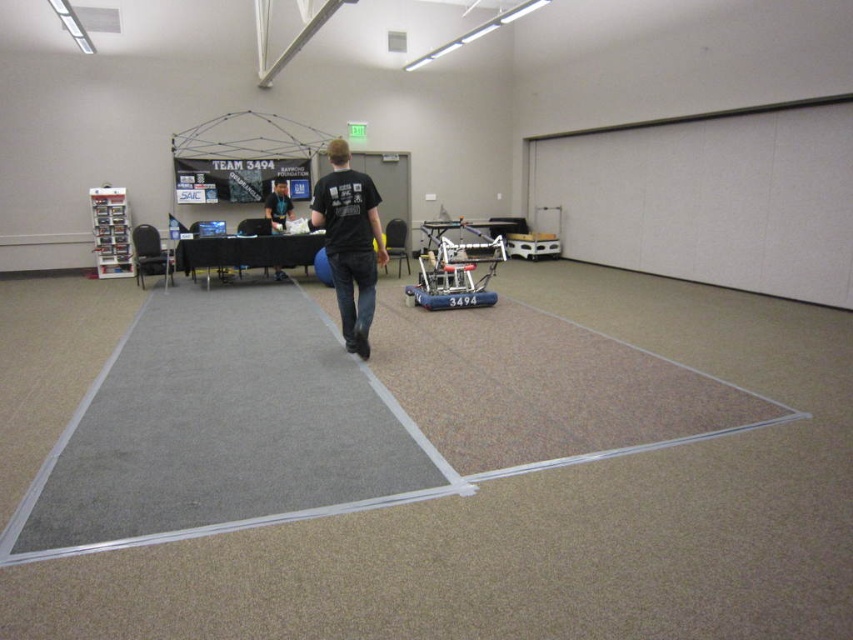
You are a photographer standing in the conference room. You need to take a photo that includes both the black cotton shirt at center and the blue rubber robot at center. Which object will appear larger in the photo?

The black cotton shirt at center will appear larger in the photo because it is bigger than the blue rubber robot at center.